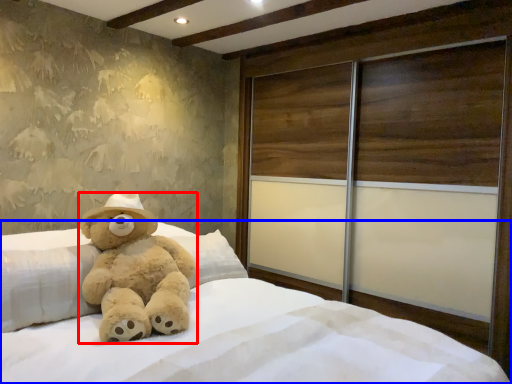
Question: Among these objects, which one is nearest to the camera, teddy bear (highlighted by a red box) or bed (highlighted by a blue box)?

Choices:
 (A) teddy bear
 (B) bed

Answer: (B)